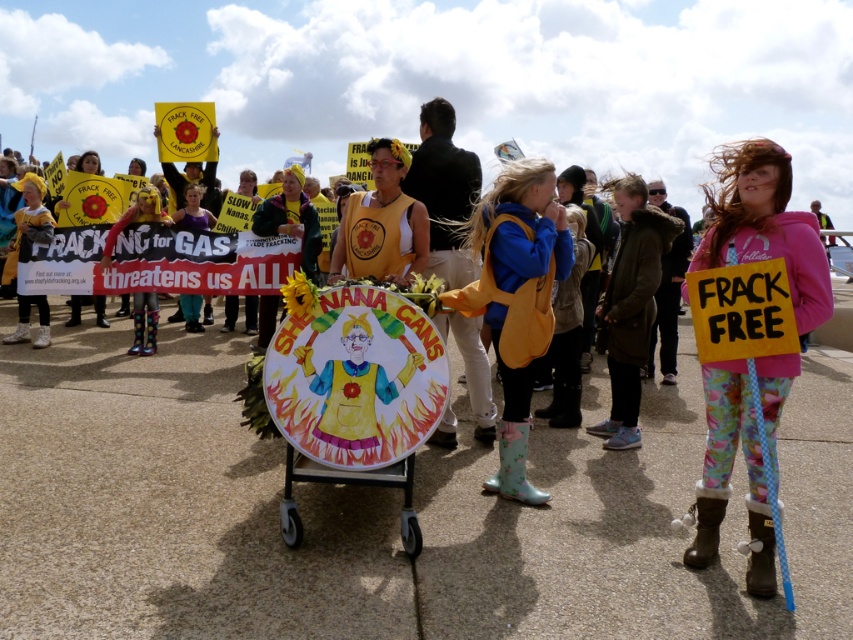
You are a photographer standing at the center of the protest area. You want to capture a photo that includes both the point at (793, 358) and the point at (471, 234). Which point should you focus on first to ensure both are in frame?

You should focus on the point at (793, 358) first because it is in front of the point at (471, 234), ensuring both are visible in the photo.